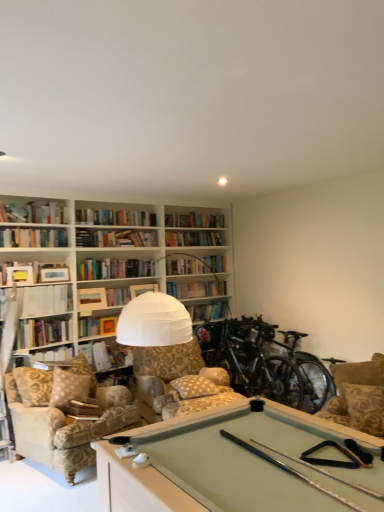
The height and width of the screenshot is (512, 384). What do you see at coordinates (194, 387) in the screenshot?
I see `white dotted fabric pillow at center` at bounding box center [194, 387].

The width and height of the screenshot is (384, 512). What do you see at coordinates (46, 300) in the screenshot? I see `white paper at upper left, the 1th book viewed from the left` at bounding box center [46, 300].

This screenshot has height=512, width=384. What do you see at coordinates (265, 362) in the screenshot?
I see `green matte bicycle at right` at bounding box center [265, 362].

At what (x,y) coordinates should I click in order to perform the action: click on green matte bicycle at right. Please return your answer as a coordinate pair (x, y). Looking at the image, I should click on (265, 362).

Describe the element at coordinates (105, 355) in the screenshot. I see `hardcover book at center, the first book in the bottom-to-top sequence` at that location.

In order to face patterned fabric armchair at right, should I rotate leftwards or rightwards?

Turn right approximately 21.506 degrees to face it.

The width and height of the screenshot is (384, 512). I want to click on white dotted fabric pillow at center, so click(x=194, y=387).

Can you confirm if white paper at upper left, the 1th book viewed from the left, is positioned to the left of green matte bicycle at right?

Yes.

Is white paper at upper left, the 1th book viewed from the left, directly adjacent to green matte bicycle at right?

They are not placed beside each other.

From the image's perspective, is white paper at upper left, which is the 1th book in top-to-bottom order, above or below green matte bicycle at right?

Based on their image positions, white paper at upper left, which is the 1th book in top-to-bottom order, is located above green matte bicycle at right.

Looking at their sizes, would you say patterned fabric armchair at right is wider or thinner than velvet beige armchair at lower left?

Considering their sizes, patterned fabric armchair at right looks slimmer than velvet beige armchair at lower left.

There is a velvet beige armchair at lower left. Find the location of `armchair above it (from a real-world perspective)`. armchair above it (from a real-world perspective) is located at coordinates (358, 396).

Is patterned fabric armchair at right turned away from velvet beige armchair at lower left?

No, patterned fabric armchair at right is not facing the opposite direction of velvet beige armchair at lower left.

Which object is further away from the camera taking this photo, patterned fabric armchair at right or velvet beige armchair at lower left?

Positioned behind is velvet beige armchair at lower left.

Looking at this image, is hardcover book at center, the first book positioned from the right, facing towards white paper at upper left, the 1th book viewed from the left?

No, hardcover book at center, the first book positioned from the right, is not oriented towards white paper at upper left, the 1th book viewed from the left.

At what (x,y) coordinates should I click in order to perform the action: click on book on the right of white paper at upper left, which is the 2th book from bottom to top. Please return your answer as a coordinate pair (x, y). Looking at the image, I should click on (105, 355).

Considering the sizes of objects hardcover book at center, the first book positioned from the right, and white paper at upper left, which is the 2th book from bottom to top, in the image provided, who is shorter, hardcover book at center, the first book positioned from the right, or white paper at upper left, which is the 2th book from bottom to top,?

white paper at upper left, which is the 2th book from bottom to top.

Between hardcover book at center, the second book in the left-to-right sequence, and white paper at upper left, the 1th book viewed from the left, which one has larger width?

hardcover book at center, the second book in the left-to-right sequence.

Which is correct: green matte bicycle at right is inside velvet beige armchair at lower left, or outside of it?

green matte bicycle at right exists outside the volume of velvet beige armchair at lower left.

From the image's perspective, which one is positioned higher, green matte bicycle at right or velvet beige armchair at lower left?

green matte bicycle at right is shown above in the image.

Are green matte bicycle at right and velvet beige armchair at lower left making contact?

green matte bicycle at right and velvet beige armchair at lower left are clearly separated.

Is green matte bicycle at right thinner than velvet beige armchair at lower left?

Correct, the width of green matte bicycle at right is less than that of velvet beige armchair at lower left.

In terms of size, does green matte bicycle at right appear bigger or smaller than hardcover book at center, the second book in the left-to-right sequence?

In the image, green matte bicycle at right appears to be larger than hardcover book at center, the second book in the left-to-right sequence.

Between point (326, 399) and point (93, 367), which one is positioned in front?

Point (326, 399)

From the image's perspective, who appears lower, green matte bicycle at right or hardcover book at center, the 2th book positioned from the top?

green matte bicycle at right.

Do you think green matte bicycle at right is within hardcover book at center, the 2th book positioned from the top, or outside of it?

green matte bicycle at right is located beyond the bounds of hardcover book at center, the 2th book positioned from the top.

Would you say velvet beige armchair at lower left is to the left or to the right of hardcover book at center, the first book positioned from the right, in the picture?

In the image, velvet beige armchair at lower left appears on the left side of hardcover book at center, the first book positioned from the right.

From the image's perspective, between velvet beige armchair at lower left and hardcover book at center, the second book in the left-to-right sequence, who is located below?

From the image's view, velvet beige armchair at lower left is below.

Is the position of velvet beige armchair at lower left less distant than that of hardcover book at center, the 2th book positioned from the top?

That is True.

Considering the sizes of green matte bicycle at right and white paper at upper left, the second book positioned from the right, in the image, is green matte bicycle at right taller or shorter than white paper at upper left, the second book positioned from the right,?

Clearly, green matte bicycle at right is taller compared to white paper at upper left, the second book positioned from the right.

Which is closer, (308, 370) or (47, 315)?

Point (308, 370) appears to be closer to the viewer than point (47, 315).

From a real-world perspective, is green matte bicycle at right located beneath white paper at upper left, which is the 2th book from bottom to top?

Indeed, from a real-world perspective, green matte bicycle at right is positioned beneath white paper at upper left, which is the 2th book from bottom to top.

Image resolution: width=384 pixels, height=512 pixels. In the image, there is a white paper at upper left, which is the 2th book from bottom to top. What are the coordinates of `bicycle below it (from a real-world perspective)` in the screenshot? It's located at (265, 362).

This screenshot has height=512, width=384. Identify the location of armchair lying on the right of velvet beige armchair at lower left. (358, 396).

Considering their positions, is white dotted fabric pillow at center positioned closer to patterned fabric armchair at right than green matte bicycle at right?

Based on the image, green matte bicycle at right appears to be nearer to patterned fabric armchair at right.

Which object lies further to the anchor point velvet beige armchair at lower left, white paper at upper left, the second book positioned from the right, or patterned fabric armchair at right?

patterned fabric armchair at right.

When comparing their distances from white paper at upper left, which is the 2th book from bottom to top, does white dotted fabric pillow at center or green matte bicycle at right seem further?

green matte bicycle at right.

When comparing their distances from patterned fabric armchair at right, does hardcover book at center, the first book in the bottom-to-top sequence, or white dotted fabric pillow at center seem further?

Among the two, hardcover book at center, the first book in the bottom-to-top sequence, is located further to patterned fabric armchair at right.

Looking at the image, which one is located further to hardcover book at center, the first book in the bottom-to-top sequence, velvet beige armchair at lower left or patterned fabric armchair at right?

Based on the image, patterned fabric armchair at right appears to be further to hardcover book at center, the first book in the bottom-to-top sequence.

From the image, which object appears to be farther from velvet beige armchair at lower left, white paper at upper left, which is the 1th book in top-to-bottom order, or hardcover book at center, the first book in the bottom-to-top sequence?

white paper at upper left, which is the 1th book in top-to-bottom order, is further to velvet beige armchair at lower left.

Which object lies further to the anchor point white paper at upper left, the 1th book viewed from the left, patterned fabric armchair at right or velvet beige armchair at lower left?

patterned fabric armchair at right.

Estimate the real-world distances between objects in this image. Which object is further from patterned fabric armchair at right, hardcover book at center, the first book positioned from the right, or white paper at upper left, which is the 1th book in top-to-bottom order?

Based on the image, white paper at upper left, which is the 1th book in top-to-bottom order, appears to be further to patterned fabric armchair at right.

The width and height of the screenshot is (384, 512). Find the location of `bicycle between velvet beige armchair at lower left and patterned fabric armchair at right in the horizontal direction`. bicycle between velvet beige armchair at lower left and patterned fabric armchair at right in the horizontal direction is located at coordinates (265, 362).

Identify the location of bicycle located between white dotted fabric pillow at center and patterned fabric armchair at right in the left-right direction. (265, 362).

Identify the location of book between velvet beige armchair at lower left and hardcover book at center, the second book in the left-to-right sequence, in the front-back direction. The image size is (384, 512). (46, 300).

Where is `chair between white paper at upper left, the 1th book viewed from the left, and white dotted fabric pillow at center, in the horizontal direction`? The image size is (384, 512). chair between white paper at upper left, the 1th book viewed from the left, and white dotted fabric pillow at center, in the horizontal direction is located at coordinates (66, 430).